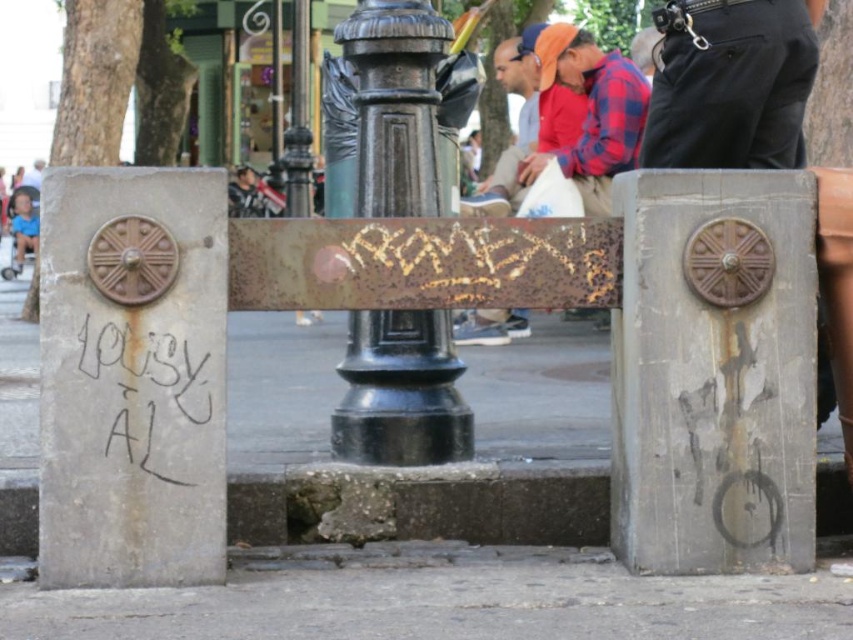
Describe the element at coordinates (444, 604) in the screenshot. I see `gray concrete pavement at lower center` at that location.

Locate an element on the screen. Image resolution: width=853 pixels, height=640 pixels. gray concrete pavement at lower center is located at coordinates (444, 604).

Is black polished metal pole at center in front of blue denim shorts at left?

Yes, black polished metal pole at center is in front of blue denim shorts at left.

The height and width of the screenshot is (640, 853). What do you see at coordinates (399, 392) in the screenshot? I see `black polished metal pole at center` at bounding box center [399, 392].

Image resolution: width=853 pixels, height=640 pixels. Identify the location of black polished metal pole at center. (399, 392).

Does black polished metal pole at center appear on the left side of concrete at lower left?

Correct, you'll find black polished metal pole at center to the left of concrete at lower left.

Between point (399, 330) and point (378, 524), which one is positioned behind?

The point (399, 330) is behind.

Where is `black polished metal pole at center`? This screenshot has height=640, width=853. black polished metal pole at center is located at coordinates (399, 392).